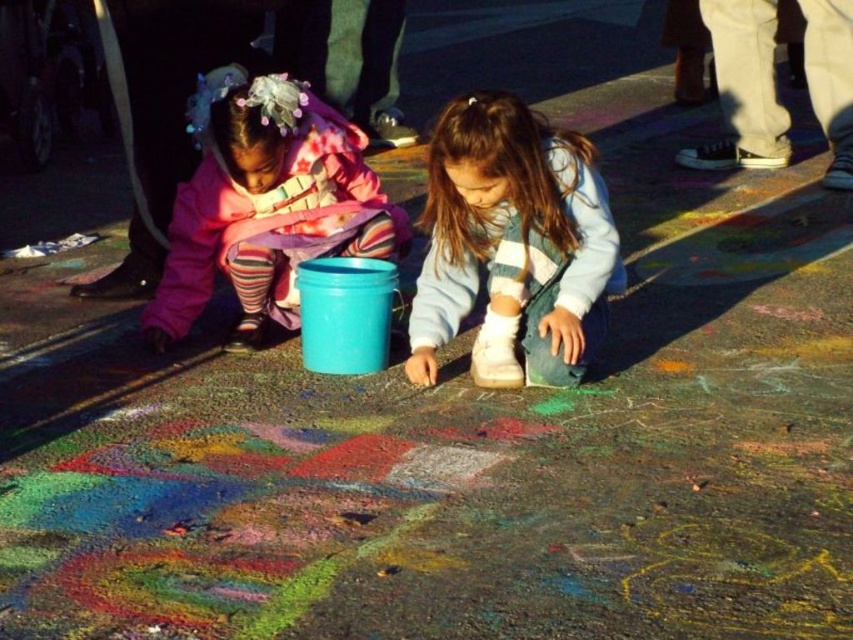
You are standing in the middle of the sidewalk and see two points marked on the ground. One is at point (498,131) and the other is at point (204,284). Which point is closer to you?

Point (498,131) is in front of point (204,284), so it is closer to you.

You are a delivery robot that needs to place a small package between the white suede sneakers at center and the matte pink jacket at left. The package requires a minimum of 30 inches of space to fit. Based on the scene, can you determine if there is enough space between the two objects?

The white suede sneakers at center is 27.21 inches from matte pink jacket at left, which is less than the required 30 inches. Therefore, there is not enough space to place the package between them.